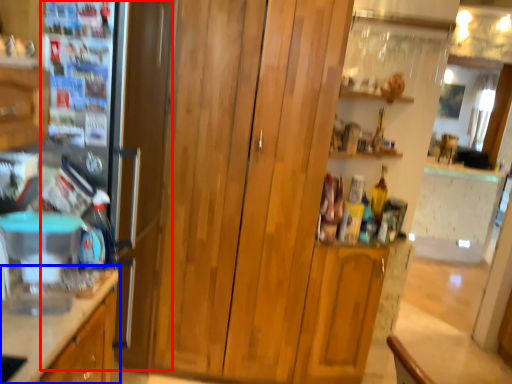
Question: Among these objects, which one is nearest to the camera, fridge (highlighted by a red box) or cabinetry (highlighted by a blue box)?

Choices:
 (A) fridge
 (B) cabinetry

Answer: (B)